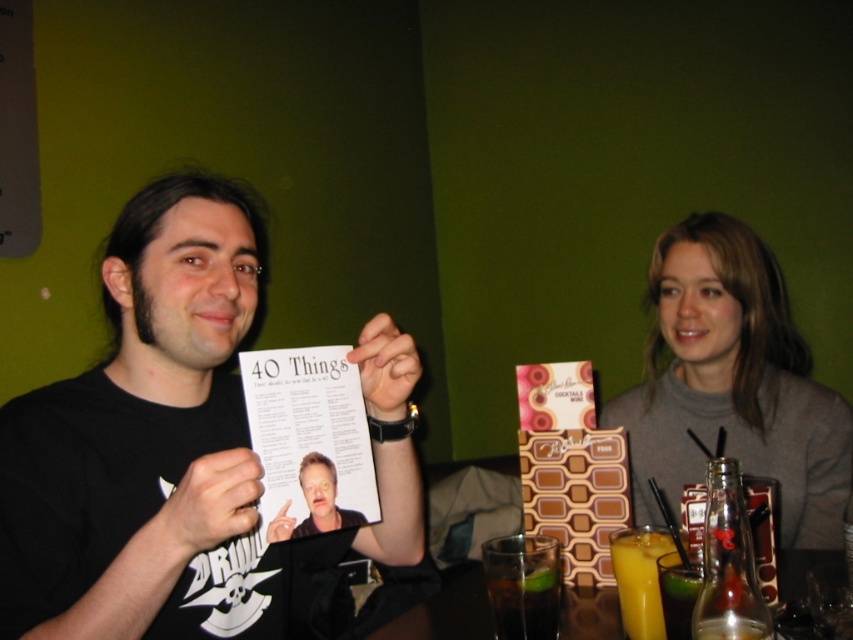
From the picture: You are a waiter at a restaurant and need to deliver a drink to the table. The drink must be placed exactly 40 centimeters away from the white paper menu at center. Can you place the translucent glass at lower right in the correct position?

The white paper menu at center is currently 38.07 centimeters away from the translucent glass at lower right. Since the required distance is 40 centimeters, the glass needs to be moved 1.93 centimeters further away from the menu to meet the requirement.

You are a waiter at the cafe. You need to place a new menu on the table so it doesn not block the customer s view of the translucent glass at lower right. Where should you place the white paper menu at center?

The white paper menu at center should be placed above the translucent glass at lower right to avoid blocking its view, as the menu is already positioned above the glass according to the description.

You are a photographer trying to capture a clear shot of both the black matte paper at center and the smooth skin face at center in the scene. Since the camera can only focus on one subject at a time, which object should you choose to ensure the larger one is in focus?

The black matte paper at center is larger than the smooth skin face at center, so you should focus on the black matte paper at center to ensure the larger object is in focus.